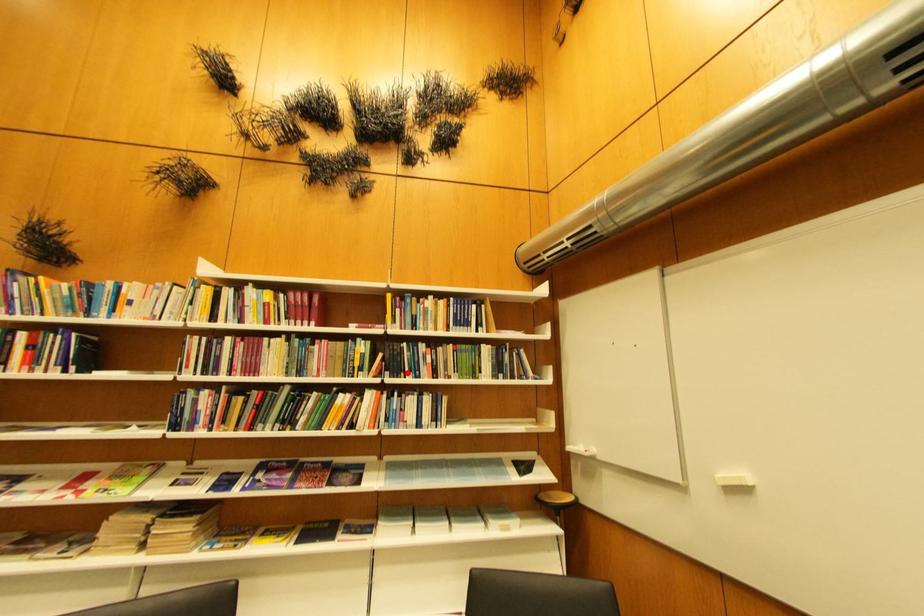
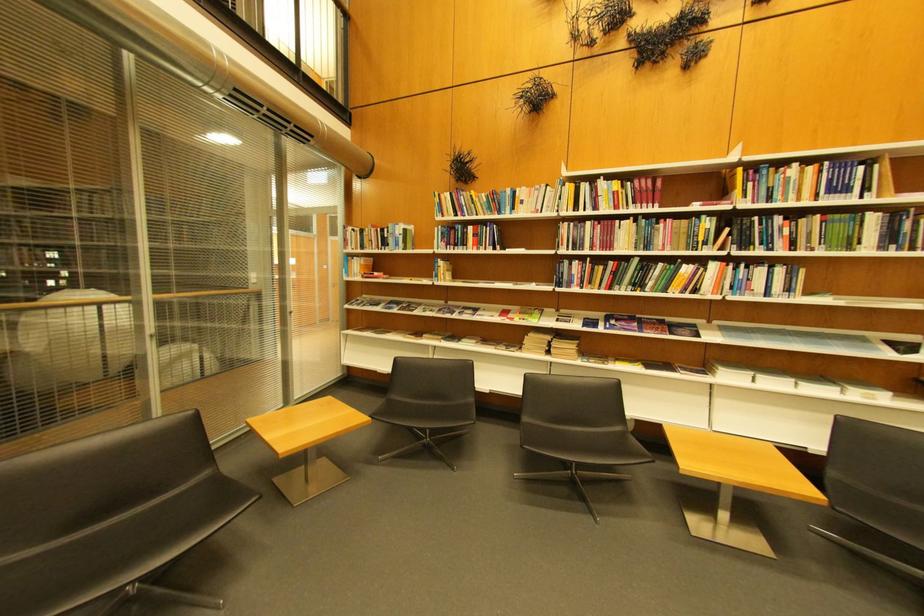
In the second image, find the point that corresponds to the highlighted location in the first image.

(756, 246)